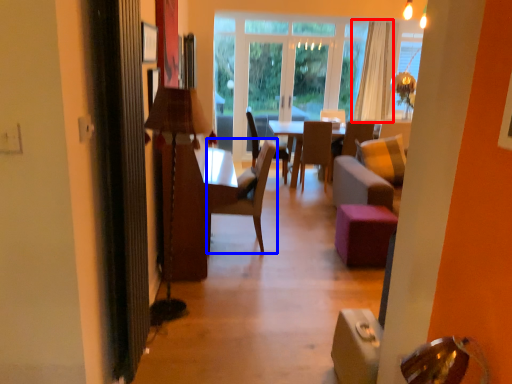
Question: Among these objects, which one is nearest to the camera, curtain (highlighted by a red box) or chair (highlighted by a blue box)?

Choices:
 (A) curtain
 (B) chair

Answer: (B)